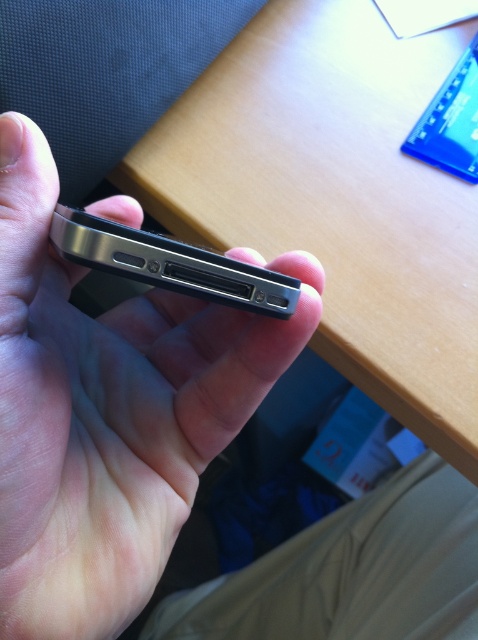
Does black matte phone at center appear on the right side of satin black smartphone at center?

In fact, black matte phone at center is to the left of satin black smartphone at center.

Between point (148, 580) and point (134, 234), which one is positioned behind?

The point (148, 580) is behind.

What do you see at coordinates (108, 413) in the screenshot? I see `black matte phone at center` at bounding box center [108, 413].

Identify the location of black matte phone at center. (108, 413).

Is wooden table at center above black matte phone at center?

Indeed, wooden table at center is positioned over black matte phone at center.

In order to click on wooden table at center in this screenshot , I will do `click(336, 196)`.

Between point (412, 308) and point (10, 445), which one is positioned in front?

Point (10, 445) is in front.

Where is `wooden table at center`? wooden table at center is located at coordinates (336, 196).

Is point (364, 157) farther from viewer compared to point (76, 244)?

Yes, it is behind point (76, 244).

Between wooden table at center and satin black smartphone at center, which one is positioned higher?

Positioned higher is wooden table at center.

Does point (443, 259) come behind point (184, 266)?

Yes, it is.

The width and height of the screenshot is (478, 640). I want to click on wooden table at center, so click(336, 196).